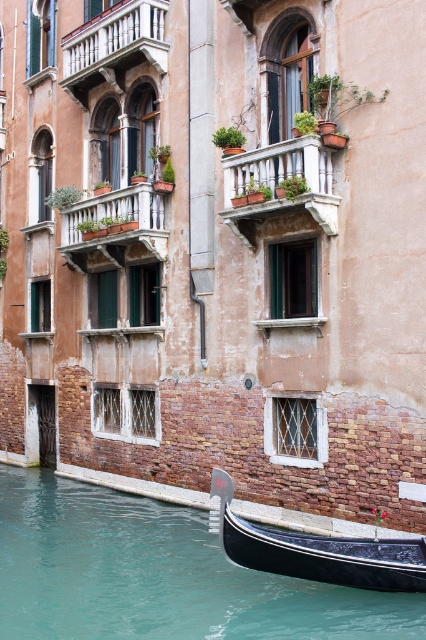
Question: Is teal glossy water at lower left positioned behind black polished wood gondola at lower right?

Choices:
 (A) no
 (B) yes

Answer: (A)

Question: Does teal glossy water at lower left have a greater width compared to black polished wood gondola at lower right?

Choices:
 (A) no
 (B) yes

Answer: (B)

Question: Can you confirm if teal glossy water at lower left is smaller than black polished wood gondola at lower right?

Choices:
 (A) yes
 (B) no

Answer: (B)

Question: Among these objects, which one is farthest from the camera?

Choices:
 (A) teal glossy water at lower left
 (B) black polished wood gondola at lower right

Answer: (B)

Question: Which object appears farthest from the camera in this image?

Choices:
 (A) black polished wood gondola at lower right
 (B) teal glossy water at lower left

Answer: (A)